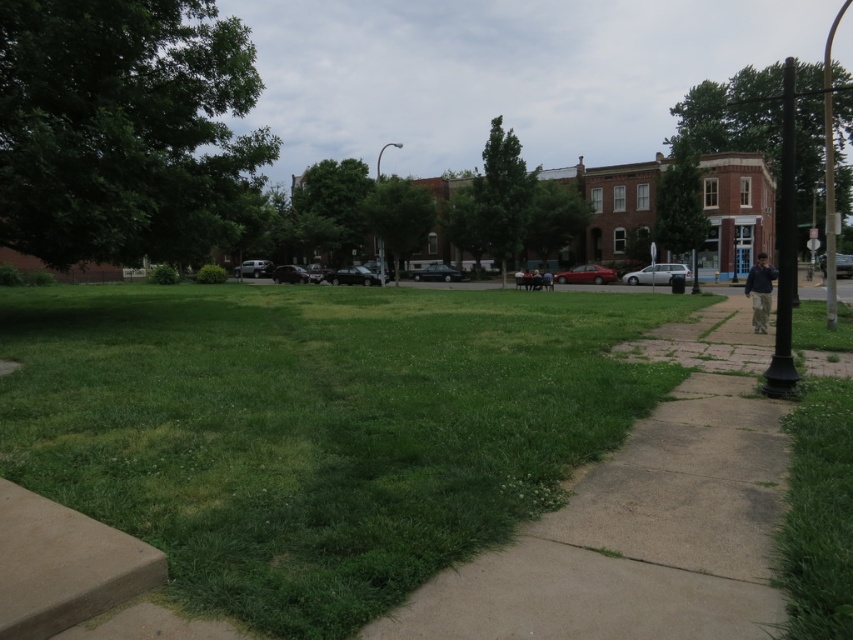
Question: Is green grassy area at center below dark blue jacket at right?

Choices:
 (A) yes
 (B) no

Answer: (A)

Question: Considering the real-world distances, which object is closest to the dark blue jacket at right?

Choices:
 (A) black metal pole at right
 (B) metallic pole at right
 (C) metallic pole at center
 (D) green grassy area at center

Answer: (D)

Question: Which object appears closest to the camera in this image?

Choices:
 (A) dark blue jacket at right
 (B) metallic pole at right
 (C) metallic pole at center

Answer: (A)

Question: Considering the relative positions of green grassy area at center and black metal pole at right in the image provided, where is green grassy area at center located with respect to black metal pole at right?

Choices:
 (A) below
 (B) above

Answer: (A)

Question: Which point is farther from the camera taking this photo?

Choices:
 (A) (830, 259)
 (B) (782, 292)
 (C) (381, 262)

Answer: (C)

Question: Is the position of dark blue jacket at right less distant than that of metallic pole at center?

Choices:
 (A) yes
 (B) no

Answer: (A)